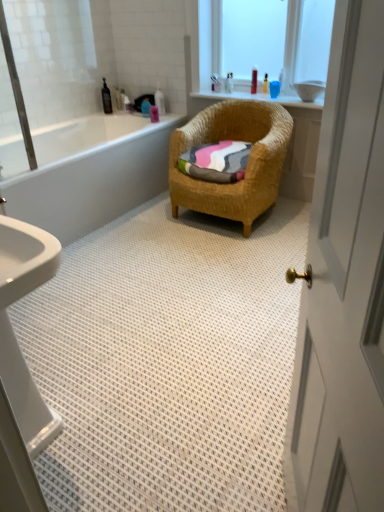
Question: Is pink matte bottle at upper center, the 3th toiletry viewed from the left, bigger or smaller than translucent plastic bottle at upper center, marked as the third toiletry in a right-to-left arrangement?

Choices:
 (A) big
 (B) small

Answer: (B)

Question: Considering the positions of pink matte bottle at upper center, the 3th toiletry viewed from the left, and translucent plastic bottle at upper center, which is the 5th toiletry from left to right, in the image, is pink matte bottle at upper center, the 3th toiletry viewed from the left, taller or shorter than translucent plastic bottle at upper center, which is the 5th toiletry from left to right,?

Choices:
 (A) short
 (B) tall

Answer: (B)

Question: Estimate the real-world distances between objects in this image. Which object is farther from the woven wicker chair at center?

Choices:
 (A) multicolored woven towel at center
 (B) translucent plastic bottle at upper center, the first toiletry positioned from the right
 (C) blue plastic bottle at upper center, which appears as the 6th toiletry when viewed from the right
 (D) white glossy bathtub at left
 (E) white glossy door at right

Answer: (E)

Question: Which object is positioned closest to the translucent plastic bottle at upper center, marked as the third toiletry in a right-to-left arrangement?

Choices:
 (A) translucent plastic bottle at upper center, which is the 7th toiletry from left to right
 (B) white glossy door at right
 (C) woven wicker chair at center
 (D) black plastic bottle at upper left, placed as the 1th toiletry when sorted from left to right
 (E) white glossy bathtub at left

Answer: (A)